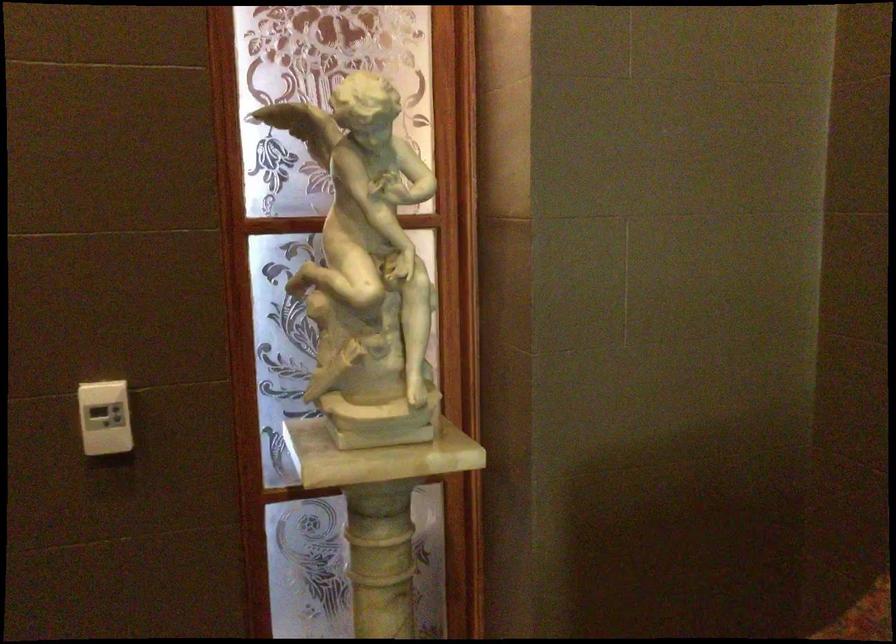
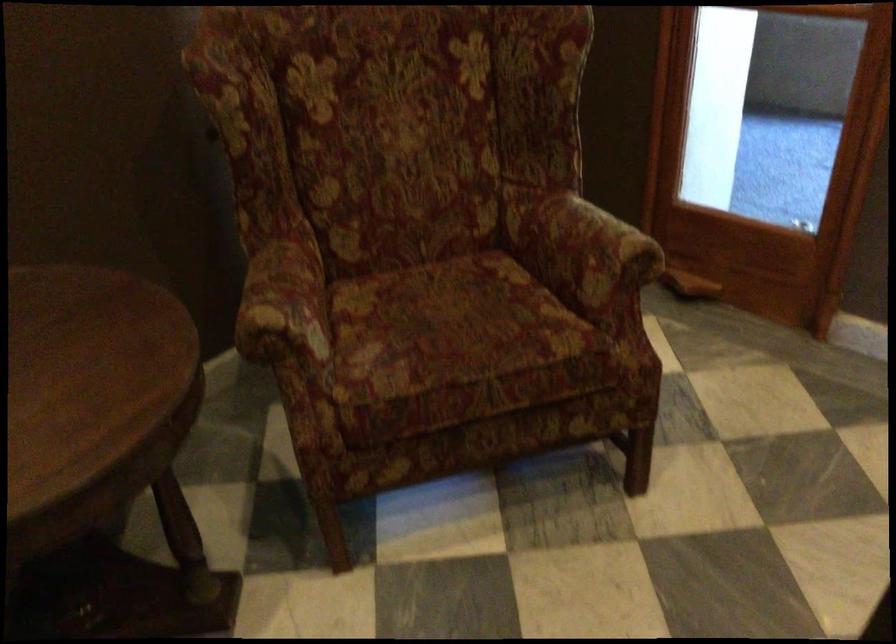
First-person continuous shooting, in which direction is the camera rotating?

The camera rotated toward right-down.